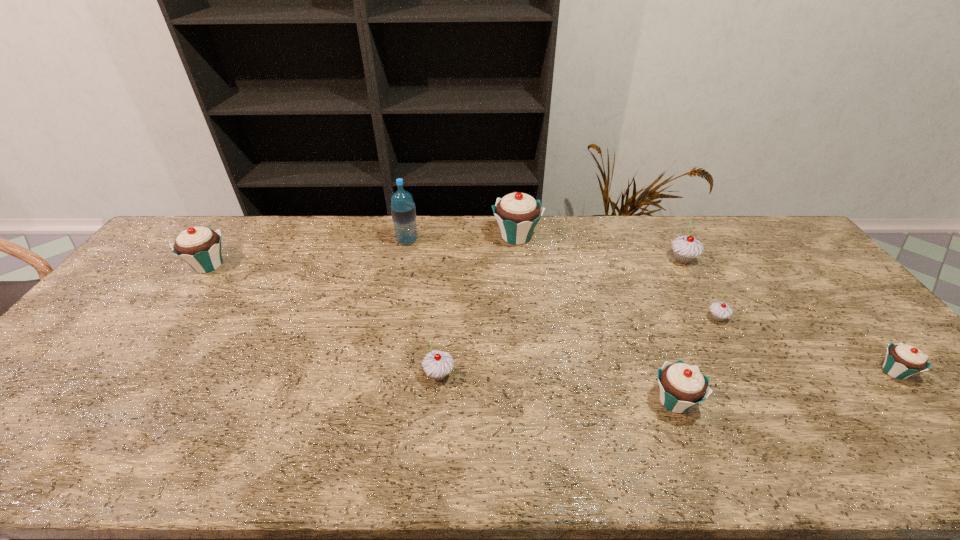
Where is `the second object from left to right`? This screenshot has height=540, width=960. the second object from left to right is located at coordinates (403, 211).

This screenshot has height=540, width=960. In order to click on the tallest object in this screenshot , I will do `click(403, 211)`.

This screenshot has width=960, height=540. I want to click on the third teal cupcake from right to left, so click(517, 214).

Image resolution: width=960 pixels, height=540 pixels. I want to click on the fourth object from left to right, so click(517, 214).

Locate an element on the screen. the farthest gray cupcake is located at coordinates (685, 249).

Find the location of a particular element. Image resolution: width=960 pixels, height=540 pixels. the leftmost cupcake is located at coordinates click(x=200, y=247).

The image size is (960, 540). I want to click on the second biggest teal cupcake, so click(200, 247).

Find the location of a particular element. The height and width of the screenshot is (540, 960). the sixth object from right to left is located at coordinates (437, 364).

I want to click on the leftmost gray cupcake, so click(437, 364).

At what (x,y) coordinates should I click in order to perform the action: click on the second teal cupcake from right to left. Please return your answer as a coordinate pair (x, y). The height and width of the screenshot is (540, 960). Looking at the image, I should click on (682, 386).